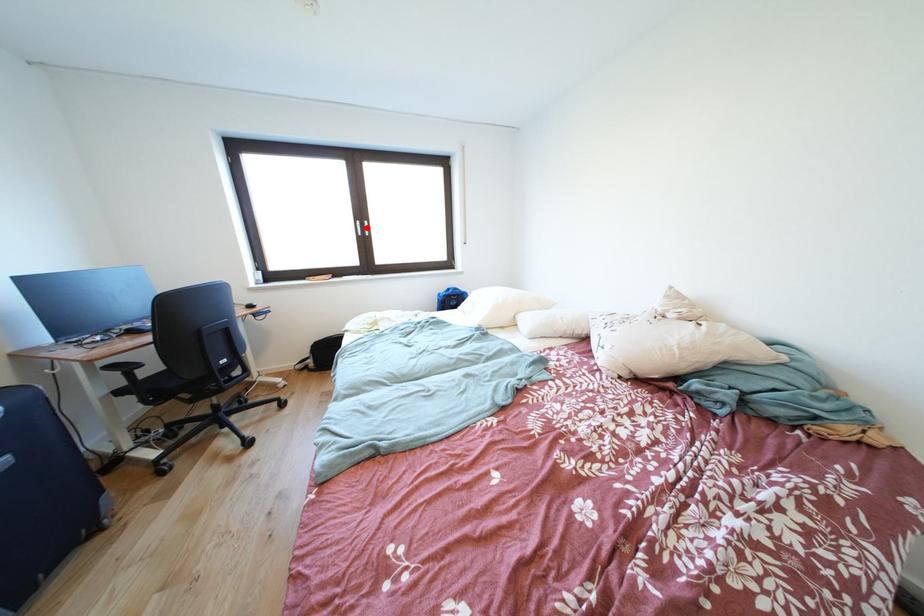
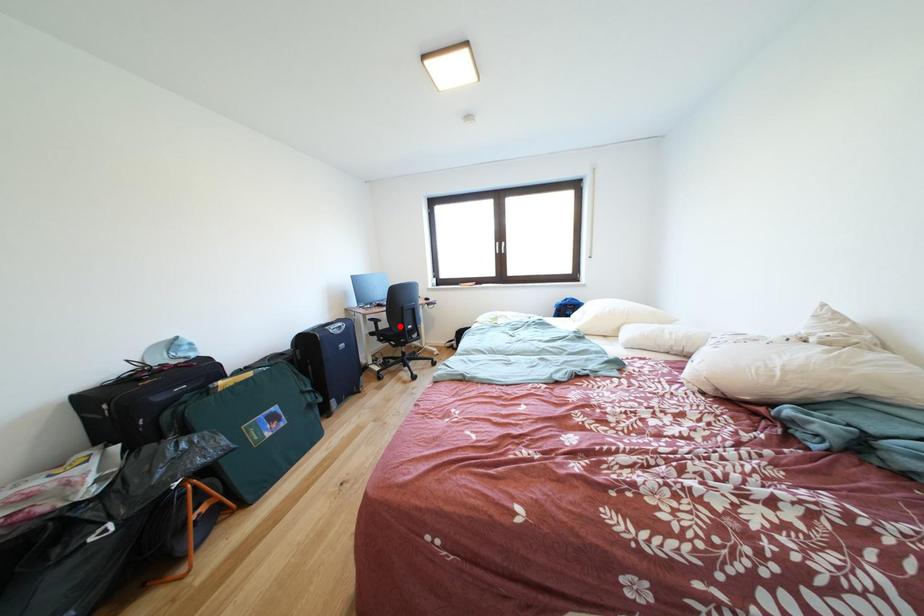
I am providing you with two images of the same scene from different viewpoints. A red point is marked on the first image and another point is marked on the second image. Does the point marked in image1 correspond to the same location as the one in image2?

No